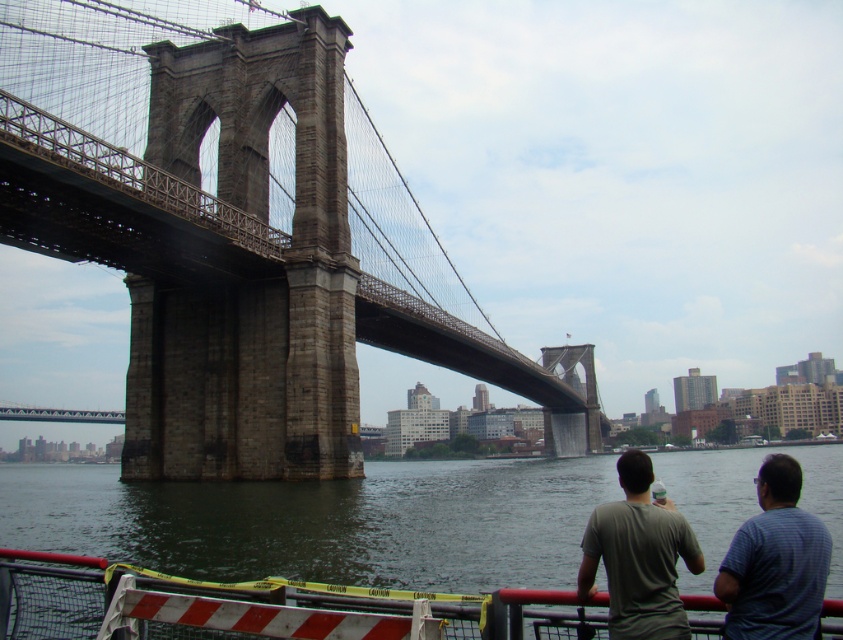
Which is in front, point (274, 244) or point (677, 483)?

Point (274, 244) is more forward.

Image resolution: width=843 pixels, height=640 pixels. Describe the element at coordinates (240, 234) in the screenshot. I see `stone bridge at center` at that location.

Identify the location of stone bridge at center. The image size is (843, 640). (240, 234).

Can you confirm if stone bridge at center is thinner than dark gray water at lower center?

Yes, stone bridge at center is thinner than dark gray water at lower center.

Is stone bridge at center above dark gray water at lower center?

Indeed, stone bridge at center is positioned over dark gray water at lower center.

Is point (250, 173) behind point (291, 506)?

Yes, it is behind point (291, 506).

This screenshot has width=843, height=640. What are the coordinates of `stone bridge at center` in the screenshot? It's located at (240, 234).

Which is in front, point (449, 561) or point (761, 564)?

Point (761, 564)

Between dark gray water at lower center and gray striped shirt at right, which one appears on the left side from the viewer's perspective?

dark gray water at lower center

Where is `dark gray water at lower center`? dark gray water at lower center is located at coordinates (325, 522).